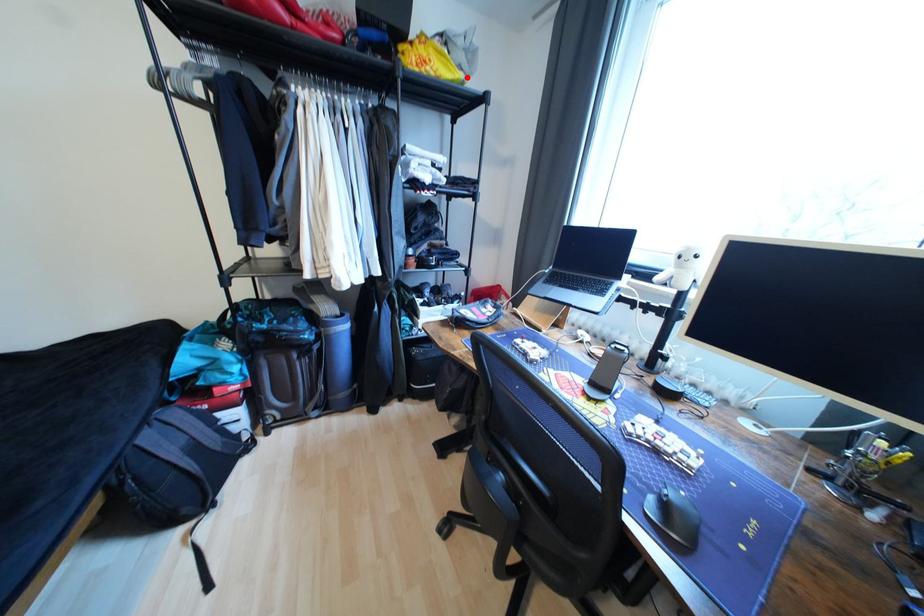
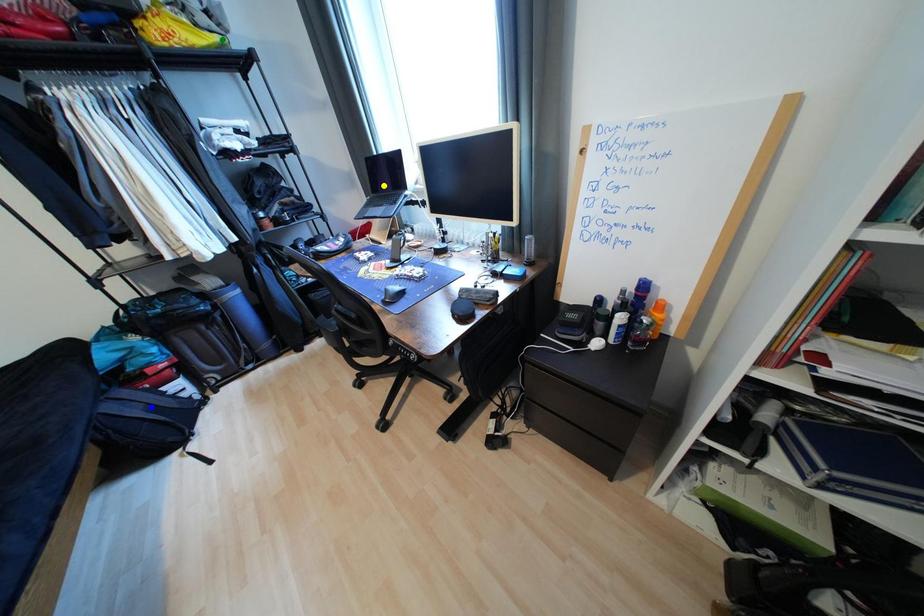
Question: I am providing you with two images of the same scene from different viewpoints. A red point is marked on the first image. You are given multiple points on the second image. In image 2, which mark is for the same physical point as the one in image 1?

Choices:
 (A) blue point
 (B) yellow point
 (C) green point

Answer: (C)